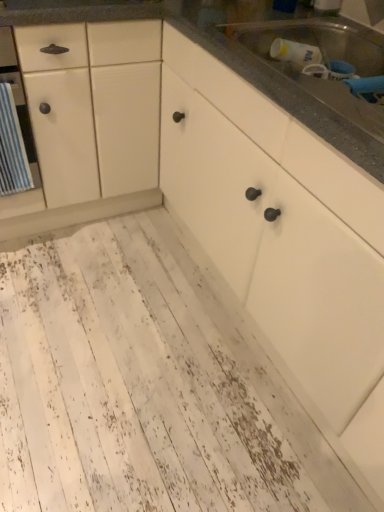
Where is `white distressed wood floor at lower left`? white distressed wood floor at lower left is located at coordinates (129, 385).

This screenshot has height=512, width=384. Find the location of `white distressed wood floor at lower left`. white distressed wood floor at lower left is located at coordinates point(129,385).

Does metallic stainless steel sink at upper right turn towards white distressed wood floor at lower left?

No, metallic stainless steel sink at upper right is not oriented towards white distressed wood floor at lower left.

Can white distressed wood floor at lower left be found inside metallic stainless steel sink at upper right?

No, white distressed wood floor at lower left is not a part of metallic stainless steel sink at upper right.

From the picture: From a real-world perspective, is metallic stainless steel sink at upper right located beneath white distressed wood floor at lower left?

No, from a real-world perspective, metallic stainless steel sink at upper right is not beneath white distressed wood floor at lower left.

Is metallic stainless steel sink at upper right in front of white distressed wood floor at lower left?

Yes, it is.

Which object is wider, metallic stainless steel sink at upper right or white wood countertop at upper right?

With larger width is white wood countertop at upper right.

Between point (296, 69) and point (376, 46), which one is positioned behind?

Positioned behind is point (296, 69).

Is metallic stainless steel sink at upper right positioned far away from white wood countertop at upper right?

No, metallic stainless steel sink at upper right is not far from white wood countertop at upper right.

How far apart are metallic stainless steel sink at upper right and white wood countertop at upper right?

They are 3.05 inches apart.

Is white wood countertop at upper right at the back of white distressed wood floor at lower left?

white distressed wood floor at lower left does not have its back to white wood countertop at upper right.

From the image's perspective, relative to white wood countertop at upper right, is white distressed wood floor at lower left above or below?

Based on their image positions, white distressed wood floor at lower left is located beneath white wood countertop at upper right.

From a real-world perspective, is white distressed wood floor at lower left on top of white wood countertop at upper right?

No, from a real-world perspective, white distressed wood floor at lower left is not over white wood countertop at upper right

Locate an element on the screen. This screenshot has width=384, height=512. countertop that is above the white distressed wood floor at lower left (from the image's perspective) is located at coordinates (255, 57).

From a real-world perspective, is white wood countertop at upper right located beneath white distressed wood floor at lower left?

No.

Considering the relative sizes of white wood countertop at upper right and white distressed wood floor at lower left in the image provided, is white wood countertop at upper right wider than white distressed wood floor at lower left?

In fact, white wood countertop at upper right might be narrower than white distressed wood floor at lower left.

Can you tell me how much white wood countertop at upper right and white distressed wood floor at lower left differ in facing direction?

The angular difference between white wood countertop at upper right and white distressed wood floor at lower left is 90.8 degrees.

Is white wood countertop at upper right outside of white distressed wood floor at lower left?

Indeed, white wood countertop at upper right is completely outside white distressed wood floor at lower left.

Could you measure the distance between white wood countertop at upper right and metallic stainless steel sink at upper right?

white wood countertop at upper right is 3.05 inches from metallic stainless steel sink at upper right.

Considering the sizes of objects white wood countertop at upper right and metallic stainless steel sink at upper right in the image provided, who is smaller, white wood countertop at upper right or metallic stainless steel sink at upper right?

metallic stainless steel sink at upper right is smaller.

Find the location of `countertop on the left of metallic stainless steel sink at upper right`. countertop on the left of metallic stainless steel sink at upper right is located at coordinates (255, 57).

Is white wood countertop at upper right aimed at metallic stainless steel sink at upper right?

Yes, white wood countertop at upper right faces towards metallic stainless steel sink at upper right.

From the picture: Between white distressed wood floor at lower left and metallic stainless steel sink at upper right, which one is positioned in front?

Positioned in front is metallic stainless steel sink at upper right.

Which is more to the left, white distressed wood floor at lower left or metallic stainless steel sink at upper right?

white distressed wood floor at lower left.

Which is behind, point (155, 406) or point (383, 46)?

Point (155, 406)

Is white distressed wood floor at lower left aimed at metallic stainless steel sink at upper right?

No.

Identify the location of sink in front of the white distressed wood floor at lower left. The width and height of the screenshot is (384, 512). (323, 62).

Where is `sink that is below the white wood countertop at upper right (from the image's perspective)`? sink that is below the white wood countertop at upper right (from the image's perspective) is located at coordinates (323, 62).

When comparing their distances from white wood countertop at upper right, does metallic stainless steel sink at upper right or white distressed wood floor at lower left seem closer?

Among the two, metallic stainless steel sink at upper right is located nearer to white wood countertop at upper right.

Estimate the real-world distances between objects in this image. Which object is closer to white distressed wood floor at lower left, metallic stainless steel sink at upper right or white wood countertop at upper right?

white wood countertop at upper right is positioned closer to the anchor white distressed wood floor at lower left.

Considering their positions, is white distressed wood floor at lower left positioned further to white wood countertop at upper right than metallic stainless steel sink at upper right?

Based on the image, white distressed wood floor at lower left appears to be further to white wood countertop at upper right.

When comparing their distances from metallic stainless steel sink at upper right, does white wood countertop at upper right or white distressed wood floor at lower left seem further?

The object further to metallic stainless steel sink at upper right is white distressed wood floor at lower left.

When comparing their distances from white distressed wood floor at lower left, does white wood countertop at upper right or metallic stainless steel sink at upper right seem closer?

white wood countertop at upper right is closer to white distressed wood floor at lower left.

From the image, which object appears to be farther from metallic stainless steel sink at upper right, white distressed wood floor at lower left or white wood countertop at upper right?

The object further to metallic stainless steel sink at upper right is white distressed wood floor at lower left.

At what (x,y) coordinates should I click in order to perform the action: click on sink between white wood countertop at upper right and white distressed wood floor at lower left from top to bottom. Please return your answer as a coordinate pair (x, y). Looking at the image, I should click on tap(323, 62).